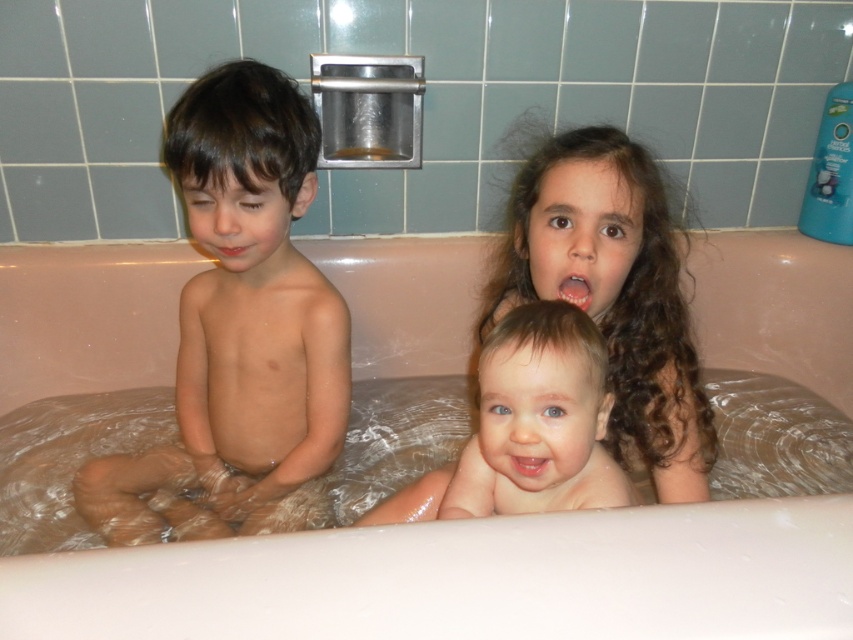
Question: Among these points, which one is farthest from the camera?

Choices:
 (A) (241, 246)
 (B) (544, 456)

Answer: (A)

Question: Can you confirm if smooth skin boy at left is positioned below smooth skin baby at center?

Choices:
 (A) no
 (B) yes

Answer: (A)

Question: Is smooth skin boy at left below transparent plastic bubble at upper center?

Choices:
 (A) yes
 (B) no

Answer: (A)

Question: Which point appears farthest from the camera in this image?

Choices:
 (A) (219, 445)
 (B) (511, 460)
 (C) (231, 248)
 (D) (558, 538)

Answer: (A)

Question: Which of the following is the closest to the observer?

Choices:
 (A) matte skin mouth at left
 (B) smooth skin boy at left
 (C) transparent plastic bubble at upper center
 (D) pink glossy lips at center

Answer: (D)

Question: Does pink glossy lips at center have a greater width compared to matte skin mouth at left?

Choices:
 (A) no
 (B) yes

Answer: (A)